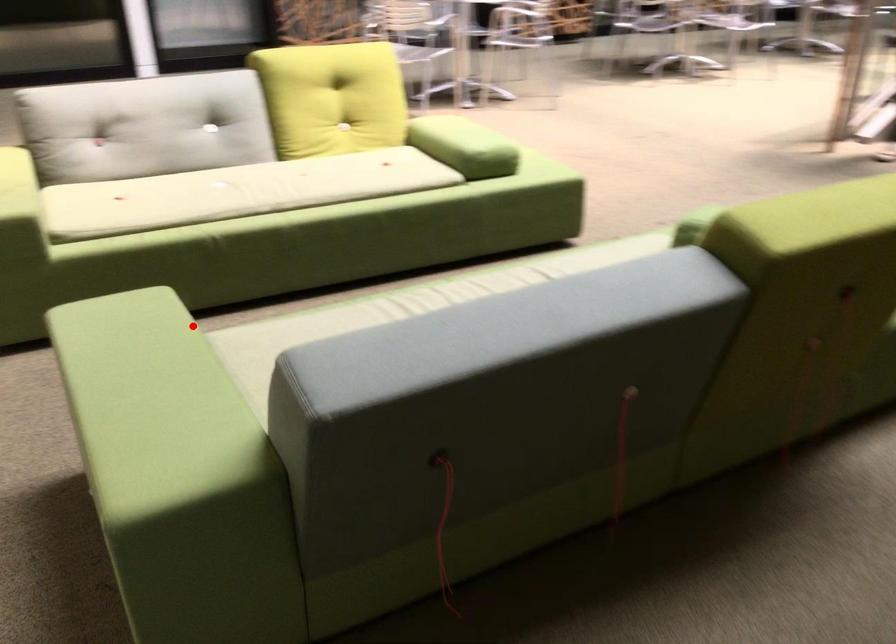
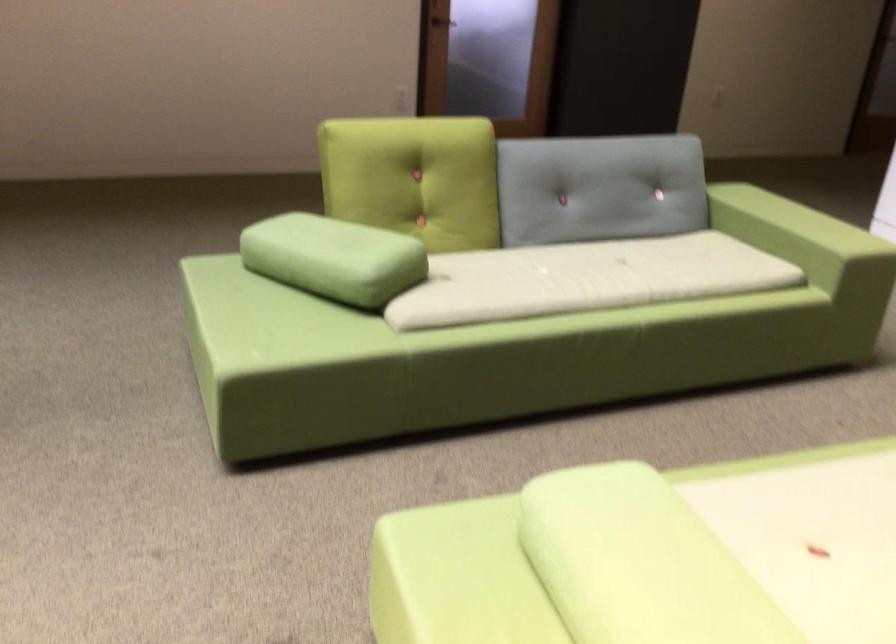
In the second image, find the point that corresponds to the highlighted location in the first image.

(794, 241)